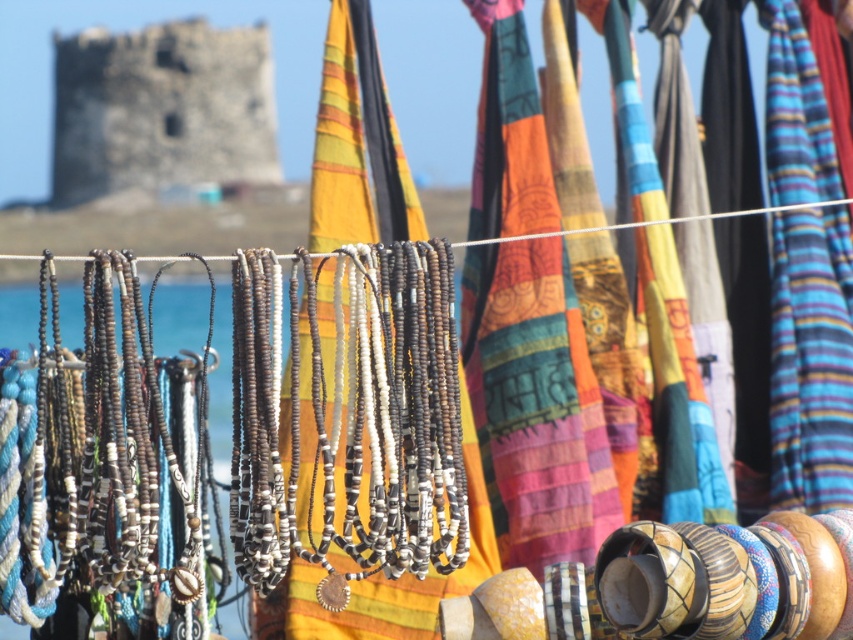
You are a customer at the market and want to buy a necklace. You notice a point marked at coordinates (349, 417). What type of jewelry item is located at this point?

The point at (349, 417) is on silver metallic beads at center.

You are a customer at the market and want to buy the silver metallic beads at center. Where exactly are they located in relation to the textiles and jewelry displays?

The silver metallic beads at center are located at coordinates point [349,417], which places them centrally within the market display area between the textiles above and the necklaces and bracelets below.

In the scene shown: You are a photographer standing at the camera position. You want to capture a closeup shot of the silver metallic beads at center. However, your camera can only focus on objects within 40 meters. Can you take the photo?

The silver metallic beads at center is 42.53 meters from camera, which is beyond the camera focus range of 40 meters. Therefore, you cannot take the photo.